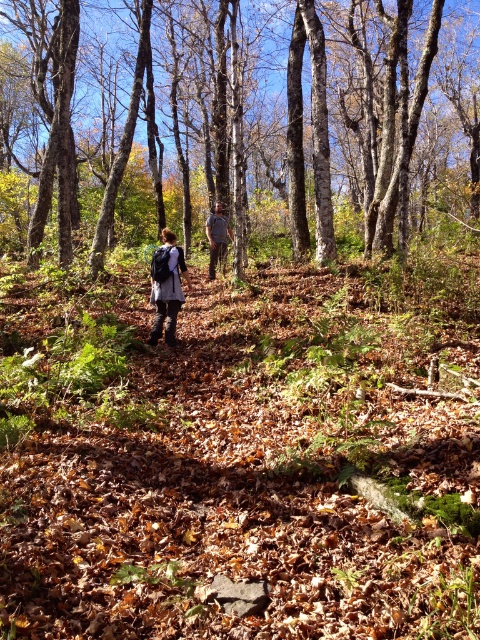
You are standing at the center of the forest path. You want to locate the brown smooth tree at center. Which direction should you look to find it?

The brown smooth tree at center is located at point coordinates (245,118), so you should look towards the center of the forest path to find it.

You are a hiker who needs to pass through the narrow forest path. You see a matte gray jacket at center and a matte gray coat at center. Can you walk between them without touching either?

The distance between the matte gray jacket at center and the matte gray coat at center is 7.64 feet, which is more than enough space for a hiker to walk through without touching either.

Looking at this image, you are standing at the entrance of the forest and see the matte gray jacket at center. Which direction should you walk to reach it?

The matte gray jacket at center is located at point (x=167, y=288), so you should walk towards the center of the forest to reach it.